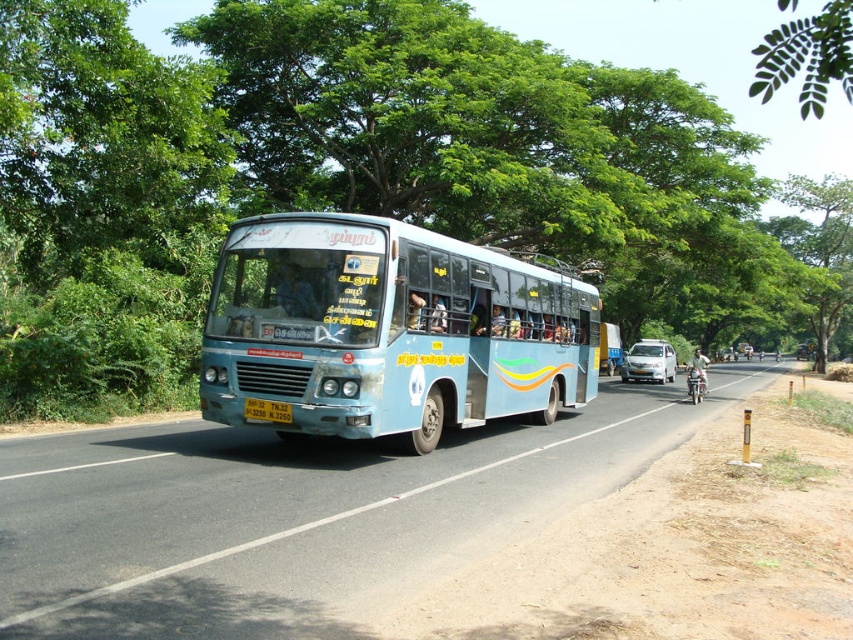
You are a pedestrian standing on the side of the road and see the yellow metallic license plate at center and the metallic silver motorcycle at right. Which object is closer to you?

The yellow metallic license plate at center is positioned over the metallic silver motorcycle at right, meaning it is closer to you.

You are a delivery driver who needs to pass a blue matte bus at center on a two lane road. The road is bordered by dense trees on both sides. Can you safely pass the bus on either side without hitting the trees?

The blue matte bus at center is located at point coordinates that are not provided in the scene description. Without knowing the exact position relative to the road edges, it is impossible to determine if there is enough space to safely pass on either side. Please consult a map or physically assess the road width before proceeding.